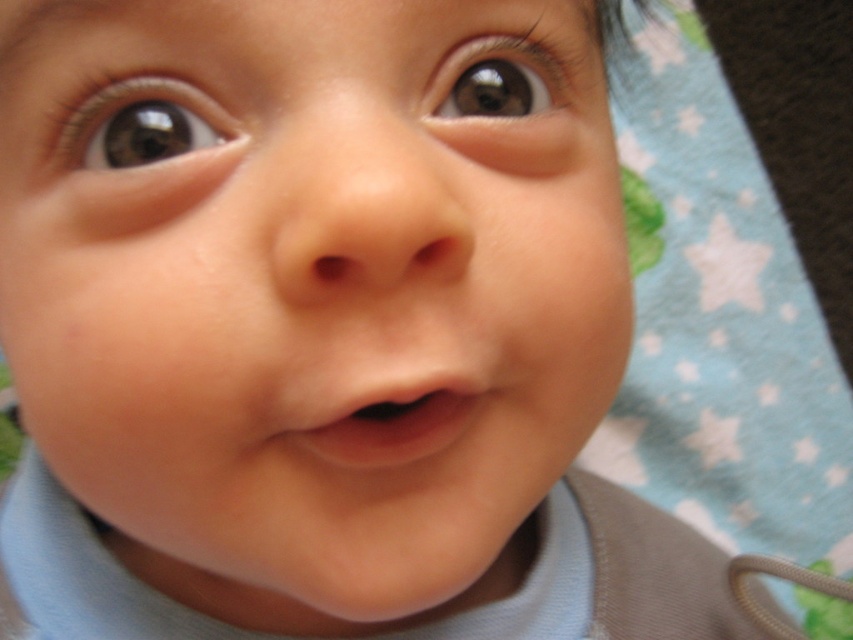
Question: Is smooth skin baby face at center above brown glossy eye at upper left?

Choices:
 (A) no
 (B) yes

Answer: (A)

Question: Is pink smooth flesh at center thinner than brown glossy eye at upper center?

Choices:
 (A) no
 (B) yes

Answer: (A)

Question: Which object appears closest to the camera in this image?

Choices:
 (A) smooth skin baby face at center
 (B) pink smooth flesh at center

Answer: (A)

Question: Can you confirm if smooth skin baby face at center is positioned below brown glossy eye at upper left?

Choices:
 (A) no
 (B) yes

Answer: (B)

Question: Which point is closer to the camera?

Choices:
 (A) (508, 48)
 (B) (312, 160)

Answer: (B)

Question: Which point is closer to the camera?

Choices:
 (A) brown glossy eye at upper left
 (B) pink smooth flesh at center
 (C) brown glossy eye at upper center

Answer: (B)